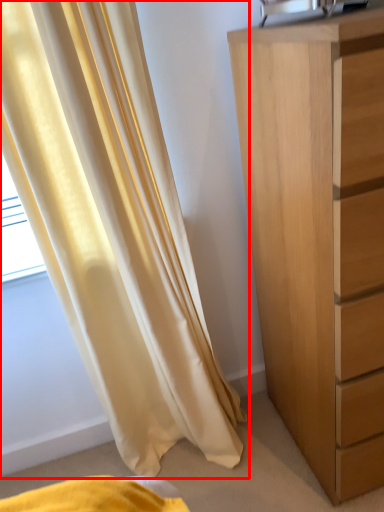
Question: From the image's perspective, what is the correct spatial positioning of curtain (annotated by the red box) in reference to chest of drawers?

Choices:
 (A) below
 (B) above

Answer: (A)